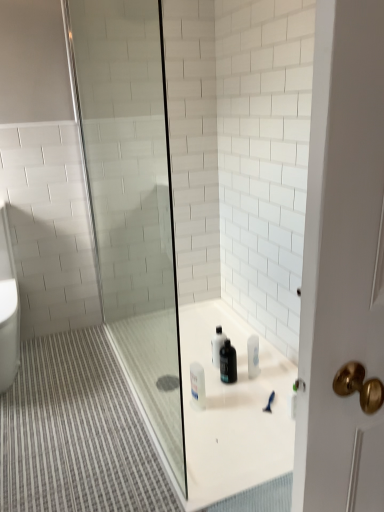
Question: Looking at the image, does black matte bottle at center seem bigger or smaller compared to transparent glass shower door at center?

Choices:
 (A) big
 (B) small

Answer: (B)

Question: In terms of width, does black matte bottle at center look wider or thinner when compared to transparent glass shower door at center?

Choices:
 (A) thin
 (B) wide

Answer: (A)

Question: In the image, is black matte bottle at center positioned in front of or behind transparent glass shower door at center?

Choices:
 (A) behind
 (B) front

Answer: (A)

Question: In terms of width, does transparent glass shower door at center look wider or thinner when compared to black matte bottle at center?

Choices:
 (A) wide
 (B) thin

Answer: (A)

Question: In the image, is transparent glass shower door at center on the left side or the right side of black matte bottle at center?

Choices:
 (A) left
 (B) right

Answer: (A)

Question: Looking at the image, does transparent glass shower door at center seem bigger or smaller compared to black matte bottle at center?

Choices:
 (A) small
 (B) big

Answer: (B)

Question: From the image's perspective, relative to black matte bottle at center, is transparent glass shower door at center above or below?

Choices:
 (A) below
 (B) above

Answer: (B)